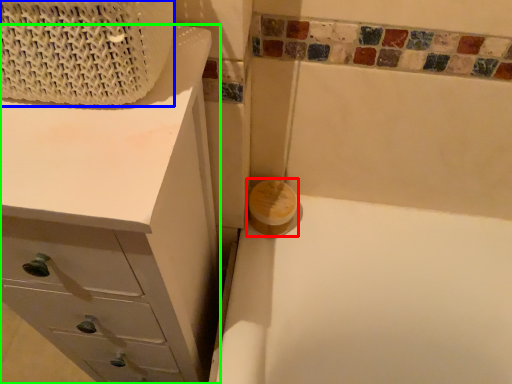
Question: Which object is the farthest from soap (highlighted by a red box)? Choose among these: basket (highlighted by a blue box) or chest of drawers (highlighted by a green box).

Choices:
 (A) basket
 (B) chest of drawers

Answer: (A)